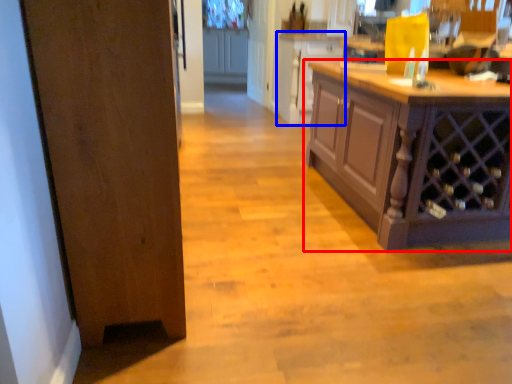
Question: Which object appears closest to the camera in this image, cabinetry (highlighted by a red box) or cabinetry (highlighted by a blue box)?

Choices:
 (A) cabinetry
 (B) cabinetry

Answer: (A)